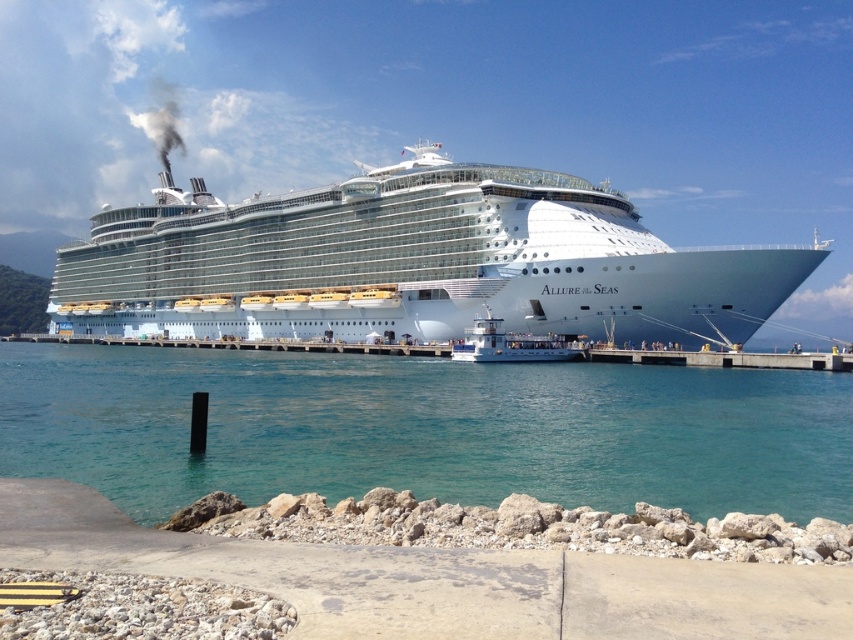
Is white glossy cruise ship at center shorter than white glossy ferry at center?

Incorrect, white glossy cruise ship at center's height does not fall short of white glossy ferry at center's.

Locate an element on the screen. The width and height of the screenshot is (853, 640). white glossy cruise ship at center is located at coordinates (410, 262).

Between point (801, 355) and point (523, 349), which one is positioned in front?

Point (801, 355)

In the scene shown: Is gray concrete dock at lower right to the left of white glossy ferry at center from the viewer's perspective?

No, gray concrete dock at lower right is not to the left of white glossy ferry at center.

Image resolution: width=853 pixels, height=640 pixels. Identify the location of gray concrete dock at lower right. (724, 358).

This screenshot has height=640, width=853. Identify the location of gray concrete dock at lower right. (724, 358).

Does point (123, 497) come closer to viewer compared to point (491, 273)?

Yes, point (123, 497) is closer to viewer.

Does clear blue water at center have a smaller size compared to white glossy cruise ship at center?

Indeed, clear blue water at center has a smaller size compared to white glossy cruise ship at center.

Is point (660, 452) less distant than point (102, 250)?

Yes, it is in front of point (102, 250).

The height and width of the screenshot is (640, 853). I want to click on clear blue water at center, so click(426, 429).